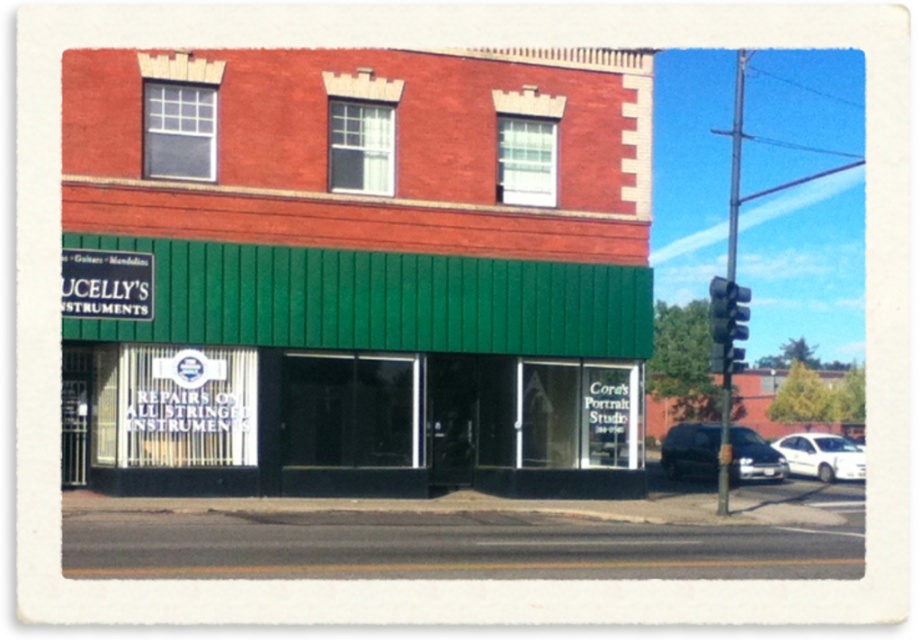
Is green woodshed at center to the left of white glossy sedan at lower right from the viewer's perspective?

Indeed, green woodshed at center is positioned on the left side of white glossy sedan at lower right.

Which of these two, green woodshed at center or white glossy sedan at lower right, stands taller?

With more height is green woodshed at center.

The width and height of the screenshot is (921, 640). Find the location of `green woodshed at center`. green woodshed at center is located at coordinates (364, 269).

Which is more to the right, white matte car at right or black plastic traffic light at upper right?

black plastic traffic light at upper right is more to the right.

Does point (707, 458) come behind point (710, 316)?

No, it is not.

Does point (684, 461) lie behind point (710, 312)?

That is False.

The height and width of the screenshot is (640, 921). What are the coordinates of `white matte car at right` in the screenshot? It's located at (690, 451).

Find the location of `green woodshed at center`. green woodshed at center is located at coordinates (364, 269).

Which is more to the left, green woodshed at center or white matte car at right?

green woodshed at center

Find the location of `green woodshed at center`. green woodshed at center is located at coordinates (364, 269).